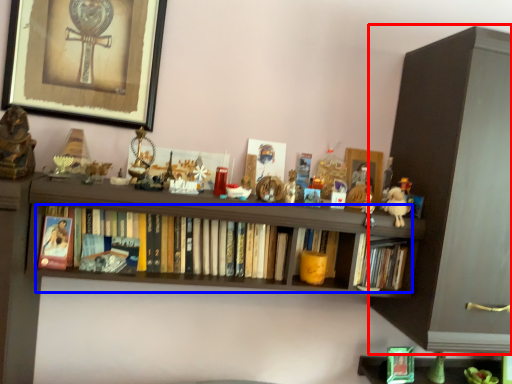
Question: Among these objects, which one is farthest to the camera, cabinetry (highlighted by a red box) or book (highlighted by a blue box)?

Choices:
 (A) cabinetry
 (B) book

Answer: (A)